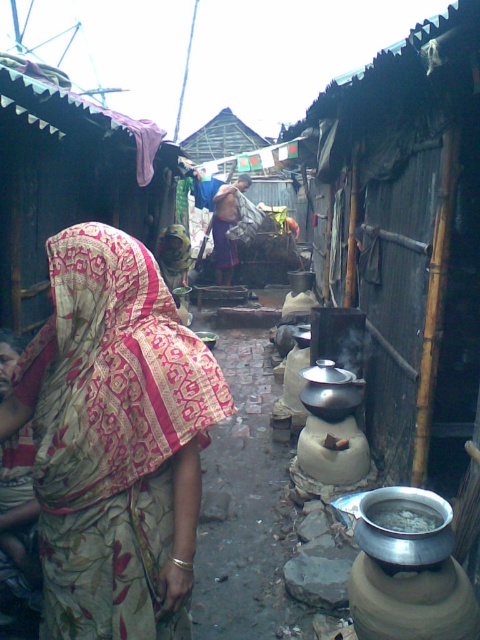
Question: Does patterned silk saree at center appear on the right side of metallic silver pot at center?

Choices:
 (A) no
 (B) yes

Answer: (A)

Question: Which object appears farthest from the camera in this image?

Choices:
 (A) metallic silver pot at center
 (B) patterned silk saree at center

Answer: (A)

Question: Among these points, which one is nearest to the camera?

Choices:
 (A) (120, 307)
 (B) (377, 508)

Answer: (A)

Question: Is patterned silk saree at center smaller than metallic silver pot at center?

Choices:
 (A) no
 (B) yes

Answer: (A)

Question: Among these points, which one is farthest from the camera?

Choices:
 (A) (80, 353)
 (B) (405, 506)

Answer: (B)

Question: Does patterned silk saree at center appear on the right side of metallic silver pot at center?

Choices:
 (A) yes
 (B) no

Answer: (B)